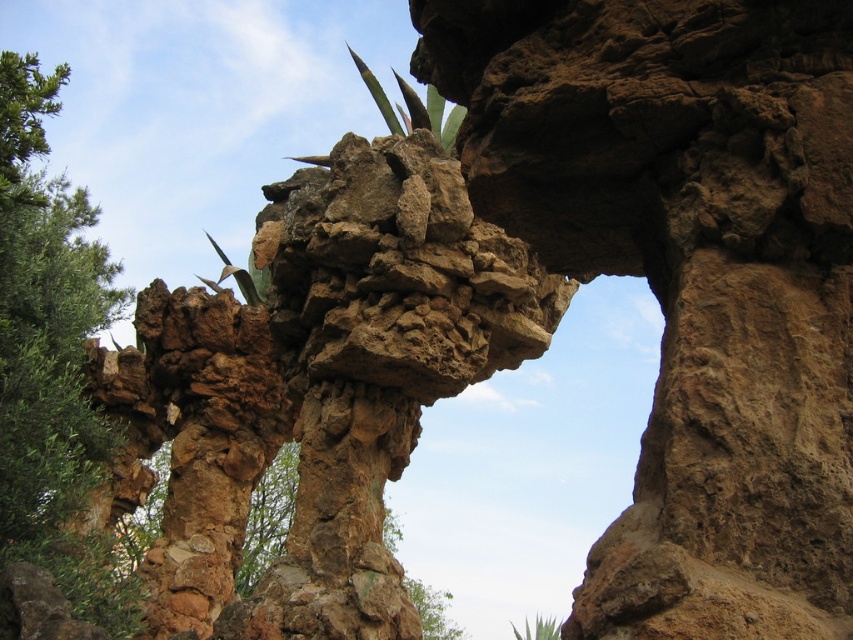
Is green leafy tree at left bigger than green leafy plant at lower center?

Correct, green leafy tree at left is larger in size than green leafy plant at lower center.

Between point (35, 310) and point (535, 628), which one is positioned in front?

Positioned in front is point (35, 310).

Identify the location of green leafy tree at left. (51, 356).